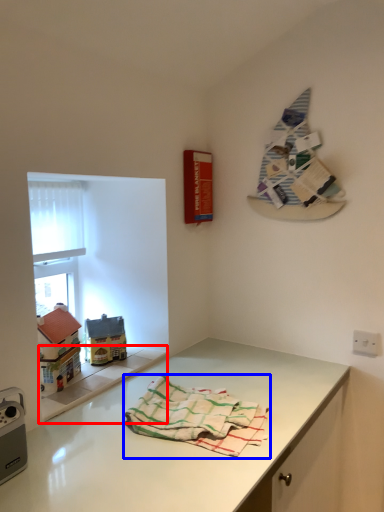
Question: Which of the following is the farthest to the observer, window sill (highlighted by a red box) or towel (highlighted by a blue box)?

Choices:
 (A) window sill
 (B) towel

Answer: (A)